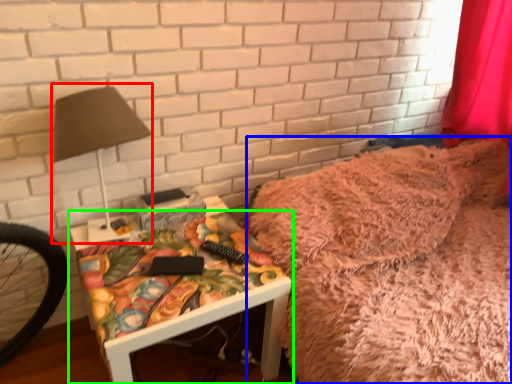
Question: Considering the real-world distances, which object is closest to table lamp (highlighted by a red box)? bed (highlighted by a blue box) or furniture (highlighted by a green box).

Choices:
 (A) bed
 (B) furniture

Answer: (B)